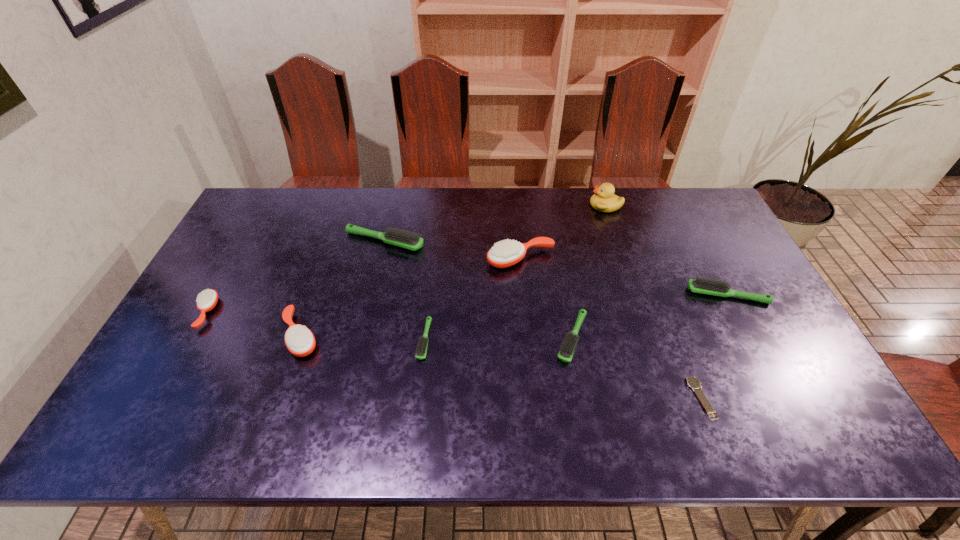
Find the location of a particular element. The image size is (960, 540). free space located on the left of the tallest hairbrush is located at coordinates (404, 259).

The image size is (960, 540). Find the location of `free location located on the right of the second orange hairbrush from right to left`. free location located on the right of the second orange hairbrush from right to left is located at coordinates (452, 335).

In order to click on vacant space located on the back of the farthest light hairbrush in this screenshot , I will do tap(390, 218).

Find the location of a particular element. The image size is (960, 540). free spot located 0.320m on the back of the rightmost object is located at coordinates (686, 217).

Locate an element on the screen. This screenshot has width=960, height=540. vacant space located on the back of the leftmost orange hairbrush is located at coordinates (255, 223).

Locate an element on the screen. blank area located on the back of the second smallest light hairbrush is located at coordinates (565, 300).

Identify the location of vacant space situated on the left of the third light hairbrush from right to left. Image resolution: width=960 pixels, height=540 pixels. (317, 340).

Image resolution: width=960 pixels, height=540 pixels. I want to click on vacant area located on the back of the shortest object, so click(679, 340).

You are a GUI agent. You are given a task and a screenshot of the screen. Output one action in this format:
    pyautogui.click(x=<x>, y=<y>)
    Task: Click on the duckling positioned at the far edge
    The width and height of the screenshot is (960, 540).
    Given the screenshot: What is the action you would take?
    pyautogui.click(x=604, y=200)

In order to click on hairbrush located in the far edge section of the desktop in this screenshot , I will do `click(408, 240)`.